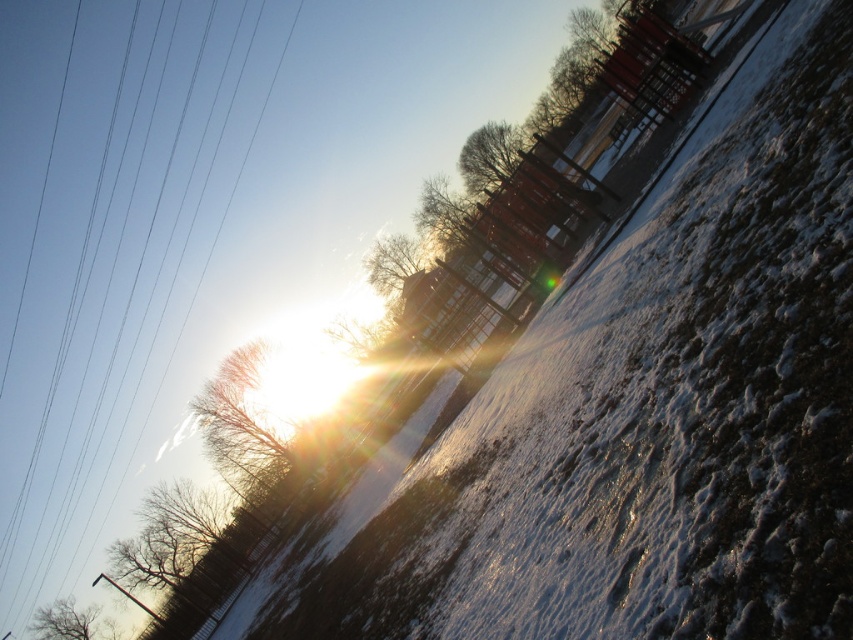
You are a hiker planning to walk from the brown textured tree at upper left to the bare brown tree at upper center. Given that your average walking speed is 1.4 meters per second, how long will it take you to reach the destination?

The distance between the brown textured tree at upper left and the bare brown tree at upper center is 40.46 meters. At a walking speed of 1.4 meters per second, it will take approximately 29 seconds to reach the destination.

Based on the photo, you are standing at the center of the image and want to take a photo of the brown textured tree at upper left. In which direction should you point your camera to capture it?

The brown textured tree at upper left is located at point coordinates, so you should point your camera to the upper left direction to capture it.

You are an observer looking at the winter scene. You notice the brown textured tree at upper left and the bare brown tree at upper center. Which tree appears closer to you based on their positions in the image?

The brown textured tree at upper left appears closer because it is positioned in front of the bare brown tree at upper center, partially obscuring it from view.